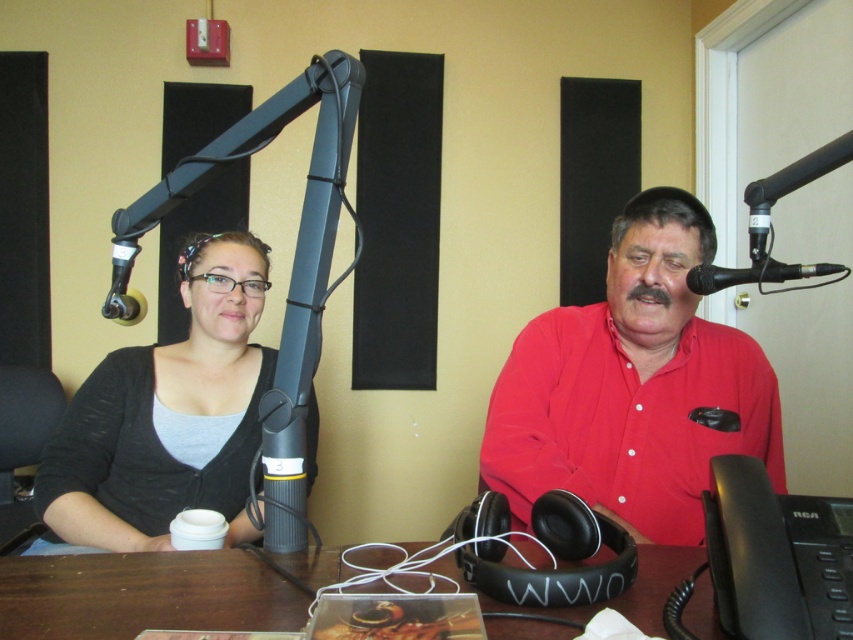
Question: Can you confirm if matte red shirt at center is smaller than brown wooden table at center?

Choices:
 (A) yes
 (B) no

Answer: (B)

Question: Among these points, which one is nearest to the camera?

Choices:
 (A) (778, 289)
 (B) (688, 445)
 (C) (216, 308)

Answer: (B)

Question: Which of these objects is positioned farthest from the matte gray cardigan at left?

Choices:
 (A) matte red shirt at center
 (B) black matte microphone at upper right
 (C) brown wooden table at center

Answer: (B)

Question: Which object is the closest to the matte red shirt at center?

Choices:
 (A) brown wooden table at center
 (B) matte gray cardigan at left
 (C) black matte microphone at upper right

Answer: (C)

Question: Is brown wooden table at center positioned before black matte microphone at upper right?

Choices:
 (A) yes
 (B) no

Answer: (A)

Question: Can you confirm if matte red shirt at center is thinner than brown wooden table at center?

Choices:
 (A) yes
 (B) no

Answer: (A)